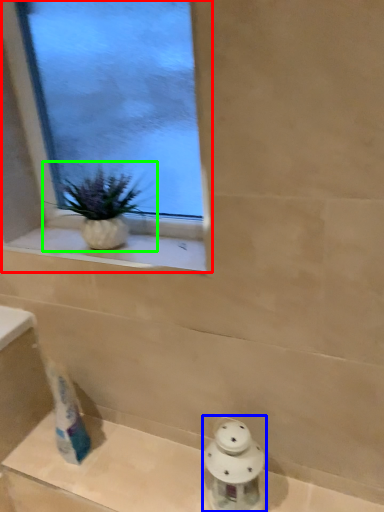
Question: Which object is positioned closest to window (highlighted by a red box)? Select from porcelain (highlighted by a blue box) and houseplant (highlighted by a green box).

Choices:
 (A) porcelain
 (B) houseplant

Answer: (B)